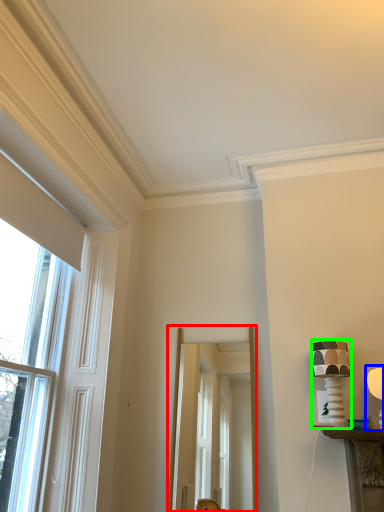
Question: Based on their relative distances, which object is nearer to screen door (highlighted by a red box)? Choose from table lamp (highlighted by a blue box) and table lamp (highlighted by a green box).

Choices:
 (A) table lamp
 (B) table lamp

Answer: (B)